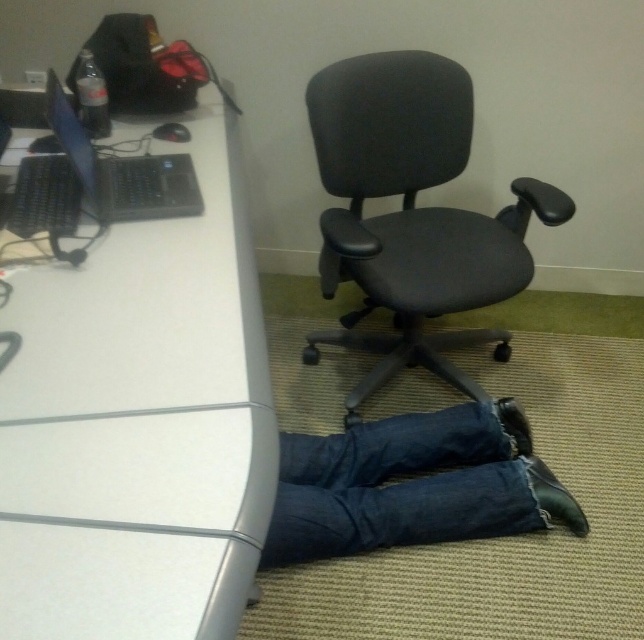
Who is taller, denim at lower center or matte black laptop at upper left?

With more height is denim at lower center.

Does denim at lower center appear on the right side of matte black laptop at upper left?

Yes, denim at lower center is to the right of matte black laptop at upper left.

Does point (283, 531) come farther from viewer compared to point (180, 172)?

No, it is in front of (180, 172).

This screenshot has height=640, width=644. I want to click on denim at lower center, so click(397, 486).

Which is in front, point (440, 76) or point (524, 432)?

Point (524, 432)

In the scene shown: Is black fabric swivel chair at center below blue denim jeans at lower center?

No.

You are a GUI agent. You are given a task and a screenshot of the screen. Output one action in this format:
    pyautogui.click(x=<x>, y=<y>)
    Task: Click on the black fabric swivel chair at center
    This screenshot has width=644, height=640.
    Given the screenshot: What is the action you would take?
    pyautogui.click(x=412, y=212)

I want to click on black fabric swivel chair at center, so click(412, 212).

Where is `matte black laptop at upper left`? The image size is (644, 640). matte black laptop at upper left is located at coordinates (122, 172).

Is matte black laptop at upper left thinner than black leather shoe at lower right?

In fact, matte black laptop at upper left might be wider than black leather shoe at lower right.

Which is behind, point (178, 163) or point (560, 499)?

The point (560, 499) is behind.

You are a GUI agent. You are given a task and a screenshot of the screen. Output one action in this format:
    pyautogui.click(x=<x>, y=<y>)
    Task: Click on the matte black laptop at upper left
    
    Given the screenshot: What is the action you would take?
    pyautogui.click(x=122, y=172)